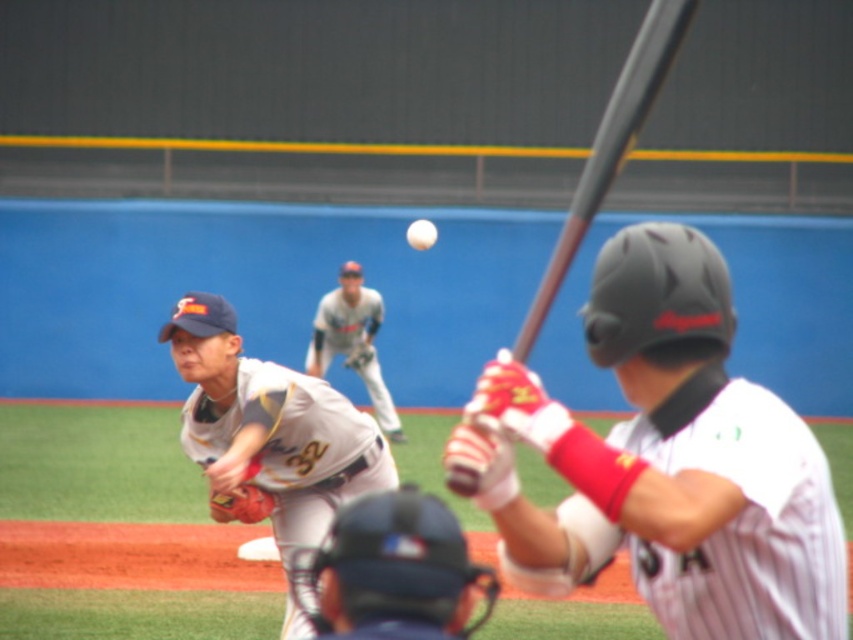
Question: Which point is farther to the camera?

Choices:
 (A) white matte helmet at upper center
 (B) brown leather glove at center
 (C) white jersey at center
 (D) gray matte bat at upper center

Answer: (B)

Question: Does dark blue helmet at center have a smaller size compared to gray matte bat at upper center?

Choices:
 (A) yes
 (B) no

Answer: (A)

Question: Which object is positioned closest to the white uniform at center?

Choices:
 (A) brown leather glove at center
 (B) brown leather glove at lower left

Answer: (B)

Question: Which object is farther from the camera taking this photo?

Choices:
 (A) white matte helmet at upper center
 (B) gray matte bat at upper center

Answer: (A)

Question: Is dark blue helmet at center bigger than white matte baseball at center?

Choices:
 (A) yes
 (B) no

Answer: (B)

Question: Is the position of dark blue helmet at center less distant than that of brown leather glove at lower left?

Choices:
 (A) yes
 (B) no

Answer: (A)